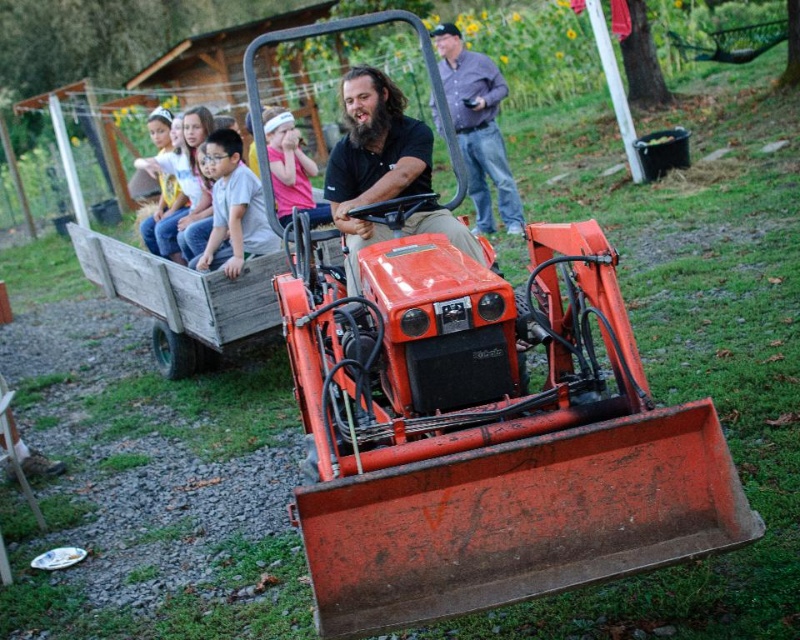
Can you confirm if brushed metal camera at upper center is taller than light gray cotton shirt at center?

Yes, brushed metal camera at upper center is taller than light gray cotton shirt at center.

Who is more distant from viewer, (480, 211) or (248, 205)?

Point (480, 211)

Which is in front, point (468, 84) or point (206, 145)?

Point (206, 145)

Where is `brushed metal camera at upper center`? The width and height of the screenshot is (800, 640). brushed metal camera at upper center is located at coordinates (478, 125).

From the picture: Is matte black tractor at center positioned behind brushed metal camera at upper center?

No, matte black tractor at center is closer to the viewer.

Does point (348, 250) lie behind point (440, 131)?

No, (348, 250) is in front of (440, 131).

Where is `matte black tractor at center`? The width and height of the screenshot is (800, 640). matte black tractor at center is located at coordinates (374, 160).

Is brushed metal camera at upper center wider than pink fabric headband at upper center?

Yes, brushed metal camera at upper center is wider than pink fabric headband at upper center.

Describe the element at coordinates (478, 125) in the screenshot. I see `brushed metal camera at upper center` at that location.

The image size is (800, 640). I want to click on brushed metal camera at upper center, so click(x=478, y=125).